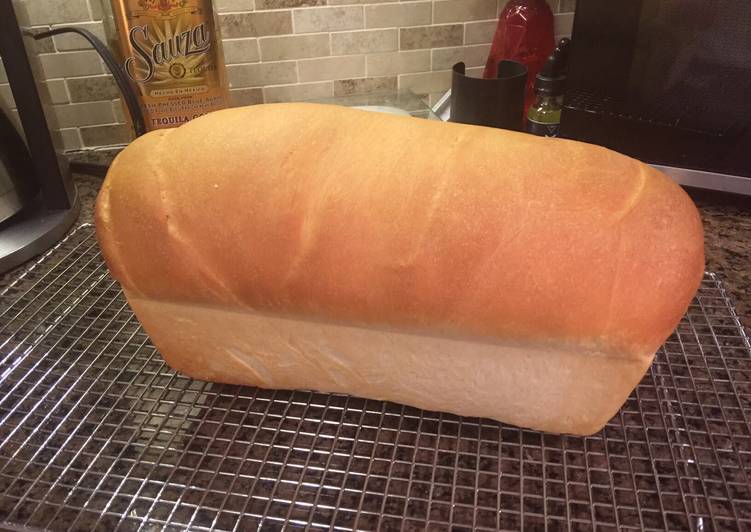
Find the location of a particular element. cooling rack is located at coordinates (341, 456).